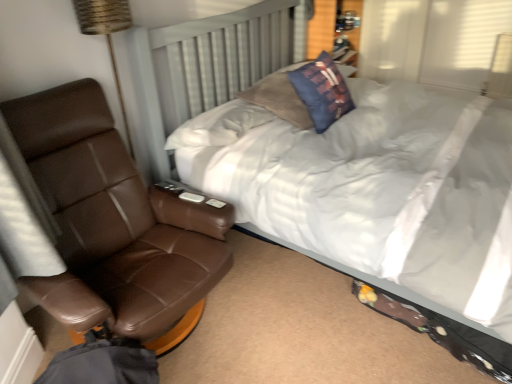
Question: Based on their positions, is white soft bed at center located to the left or right of blue fabric pillow at upper center?

Choices:
 (A) left
 (B) right

Answer: (B)

Question: Is white soft bed at center taller or shorter than blue fabric pillow at upper center?

Choices:
 (A) tall
 (B) short

Answer: (A)

Question: Estimate the real-world distances between objects in this image. Which object is farther from the brown leather chair at left?

Choices:
 (A) white soft bed at center
 (B) blue fabric pillow at upper center

Answer: (B)

Question: Which object is the farthest from the white soft bed at center?

Choices:
 (A) brown leather chair at left
 (B) blue fabric pillow at upper center

Answer: (A)